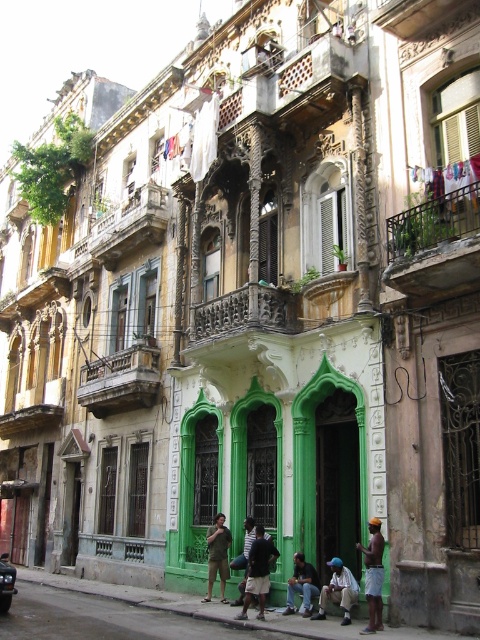
Is white cotton shirt at lower center behind dark blue jeans at center?

That is False.

Measure the distance between white cotton shirt at lower center and camera.

white cotton shirt at lower center is 41.59 meters away from camera.

The image size is (480, 640). I want to click on white cotton shirt at lower center, so click(338, 589).

Can you confirm if rustic wood balcony at upper center is taller than brown fabric shorts at lower right?

Correct, rustic wood balcony at upper center is much taller as brown fabric shorts at lower right.

What do you see at coordinates (130, 225) in the screenshot? The height and width of the screenshot is (640, 480). I see `rustic wood balcony at upper center` at bounding box center [130, 225].

Identify the location of rustic wood balcony at upper center. (130, 225).

Is rustic wood balcony at center-left closer to camera compared to rustic wood balcony at upper center?

Yes, rustic wood balcony at center-left is closer to the viewer.

Which is in front, point (112, 387) or point (103, 240)?

Point (112, 387) is in front.

Who is more forward, (143, 342) or (133, 220)?

Point (143, 342) is in front.

Identify the location of rustic wood balcony at center-left. The height and width of the screenshot is (640, 480). (120, 380).